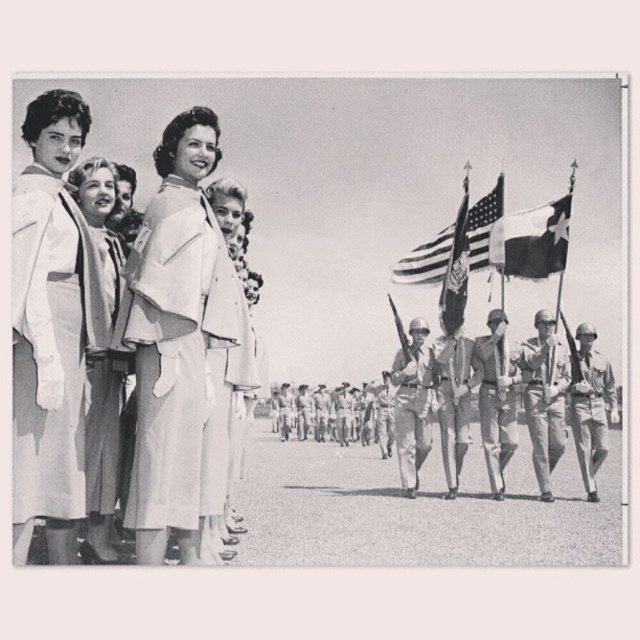
You are a photographer at the event. You want to take a photo that includes both the white fabric dress at left and the ruffled cotton flag at center right. Which object should you focus on first to ensure both are in clear view?

You should focus on the white fabric dress at left first because it is closer to the viewer than the ruffled cotton flag at center right. By focusing on the closer object, the flag will still be in focus due to the depth of field, ensuring both are clear.

You are a photographer at the event and want to capture a photo where both the american flag at upper center and the smooth khaki uniform at center are visible. Which object should you focus on to ensure both are in frame without moving the camera?

The american flag at upper center is wider than the smooth khaki uniform at center, so focusing on the american flag at upper center will ensure both are in frame since it occupies more space.